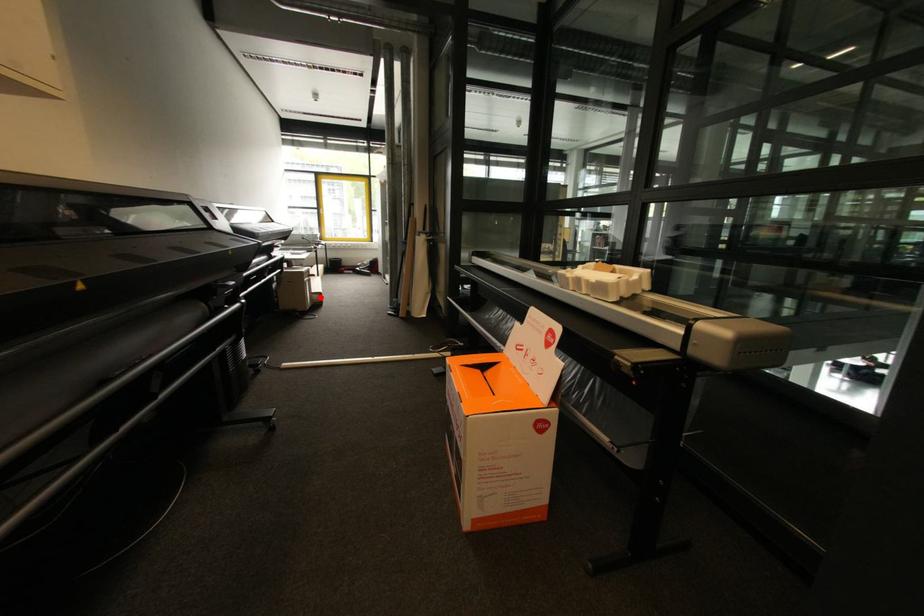
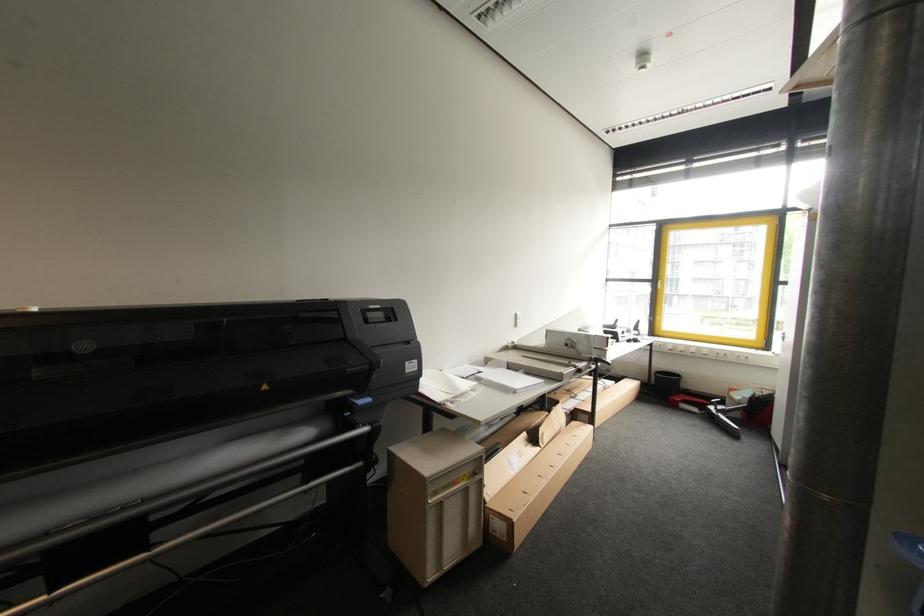
Locate, in the second image, the point that corresponds to the highlighted location in the first image.

(503, 527)